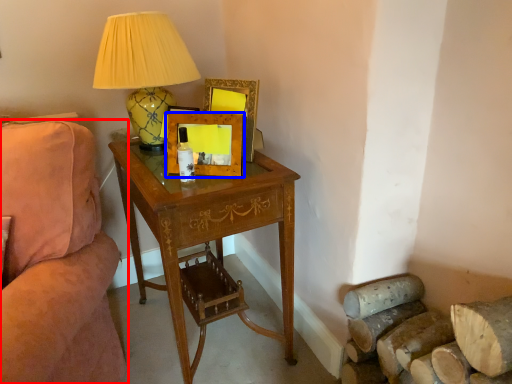
Question: Which object is further to the camera taking this photo, studio couch (highlighted by a red box) or picture frame (highlighted by a blue box)?

Choices:
 (A) studio couch
 (B) picture frame

Answer: (B)